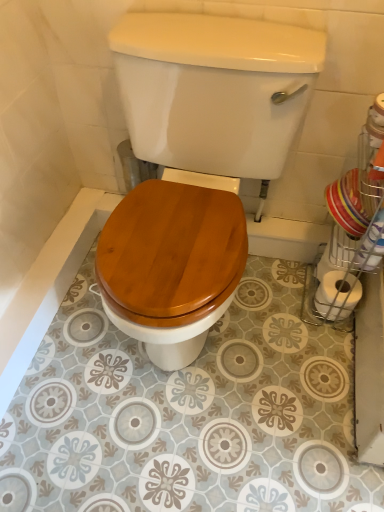
Question: From a real-world perspective, relative to wooden toilet seat at center, is white matte toilet paper at right vertically above or below?

Choices:
 (A) above
 (B) below

Answer: (B)

Question: Considering the positions of white matte toilet paper at right and wooden toilet seat at center in the image, is white matte toilet paper at right taller or shorter than wooden toilet seat at center?

Choices:
 (A) tall
 (B) short

Answer: (B)

Question: Would you say white matte toilet paper at right is inside or outside wooden toilet seat at center?

Choices:
 (A) inside
 (B) outside

Answer: (B)

Question: Is wooden toilet seat at center wider or thinner than white matte toilet paper at right?

Choices:
 (A) thin
 (B) wide

Answer: (B)

Question: From the image's perspective, is wooden toilet seat at center positioned above or below white matte toilet paper at right?

Choices:
 (A) below
 (B) above

Answer: (B)

Question: Which is correct: wooden toilet seat at center is inside white matte toilet paper at right, or outside of it?

Choices:
 (A) outside
 (B) inside

Answer: (A)

Question: Would you say wooden toilet seat at center is to the left or to the right of white matte toilet paper at right in the picture?

Choices:
 (A) left
 (B) right

Answer: (A)